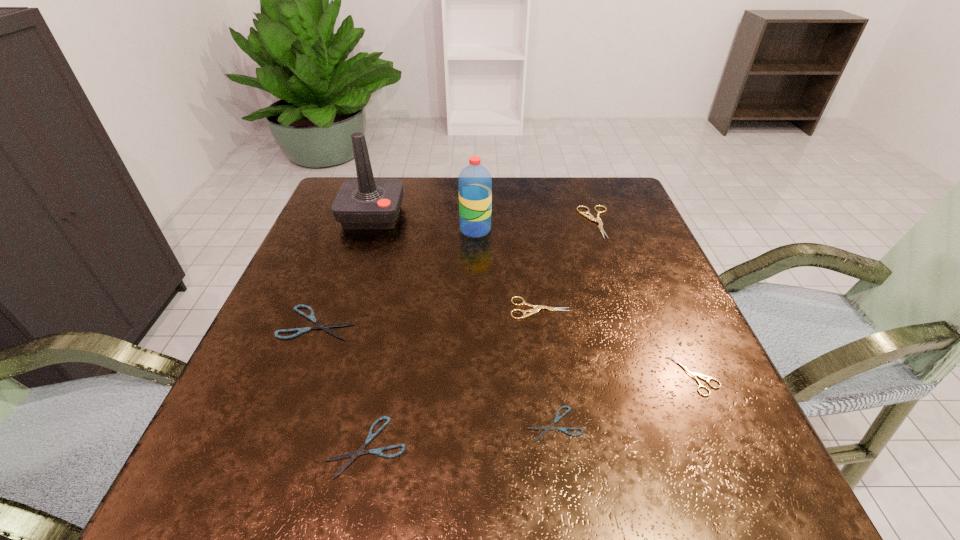
You are a GUI agent. You are given a task and a screenshot of the screen. Output one action in this format:
    pyautogui.click(x=<x>, y=<y>)
    Task: Click on the object at the far right corner
    This screenshot has height=540, width=960.
    Given the screenshot: What is the action you would take?
    pyautogui.click(x=590, y=217)

Where is `vacant space at the far edge of the desktop`? This screenshot has height=540, width=960. vacant space at the far edge of the desktop is located at coordinates (560, 213).

At what (x,y) coordinates should I click in order to perform the action: click on vacant space at the near edge of the desktop. Please return your answer as a coordinate pair (x, y). Looking at the image, I should click on (387, 484).

The image size is (960, 540). Find the location of `free space at the left edge of the desktop`. free space at the left edge of the desktop is located at coordinates tap(352, 275).

In the image, there is a desktop. Identify the location of vacant space at the right edge. This screenshot has width=960, height=540. (636, 255).

Find the location of a particular element. Image resolution: width=960 pixels, height=540 pixels. free space at the far left corner is located at coordinates (385, 179).

Locate an element on the screen. This screenshot has height=540, width=960. vacant space at the far right corner of the desktop is located at coordinates (584, 204).

Find the location of a particular element. The width and height of the screenshot is (960, 540). empty space that is in between the leftmost black shears and the second beige shears from left to right is located at coordinates (457, 272).

Locate an element on the screen. This screenshot has height=540, width=960. vacant point located between the fifth shears from right to left and the joystick is located at coordinates (370, 331).

I want to click on empty space between the red water bottle and the second nearest beige shears, so click(x=508, y=269).